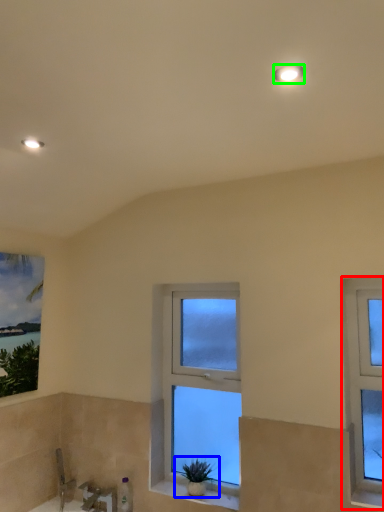
Question: Which is farther away from window (highlighted by a red box)? houseplant (highlighted by a blue box) or light fixture (highlighted by a green box)?

Choices:
 (A) houseplant
 (B) light fixture

Answer: (B)